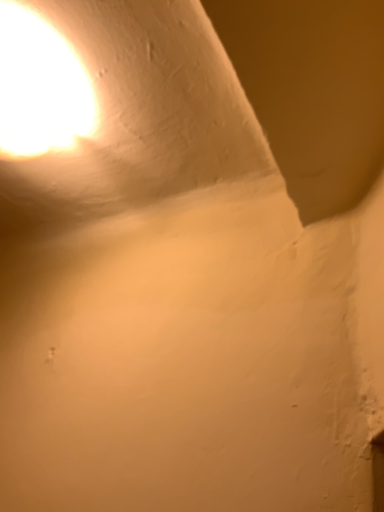
Find the location of a particular element. matte white lampshade at upper left is located at coordinates (40, 87).

The height and width of the screenshot is (512, 384). Describe the element at coordinates (40, 87) in the screenshot. I see `matte white lampshade at upper left` at that location.

Locate an element on the screen. This screenshot has width=384, height=512. matte white lampshade at upper left is located at coordinates click(x=40, y=87).